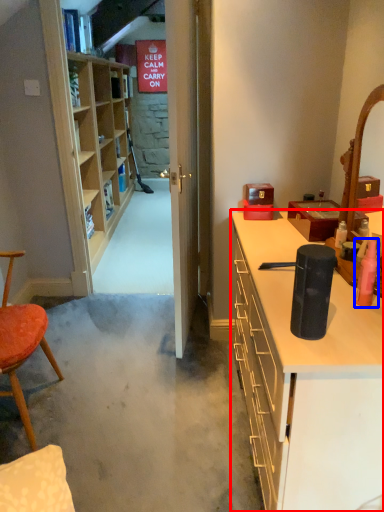
Question: Among these objects, which one is nearest to the camera, cabinetry (highlighted by a red box) or toiletry (highlighted by a blue box)?

Choices:
 (A) cabinetry
 (B) toiletry

Answer: (A)